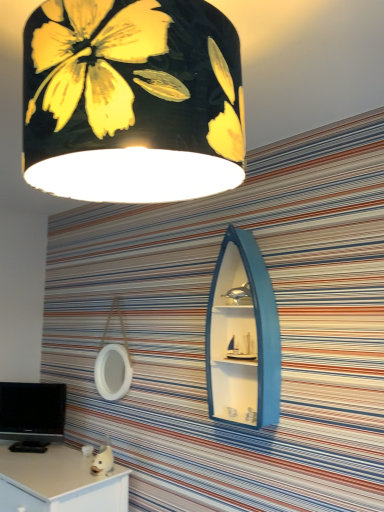
The height and width of the screenshot is (512, 384). What do you see at coordinates (32, 414) in the screenshot?
I see `black glossy computer monitor at lower left` at bounding box center [32, 414].

Locate an element on the screen. This screenshot has width=384, height=512. black glossy computer monitor at lower left is located at coordinates (32, 414).

I want to click on white matte desk at lower left, so click(59, 482).

What do you see at coordinates (132, 100) in the screenshot?
I see `black matte lampshade at upper center` at bounding box center [132, 100].

Describe the element at coordinates (242, 336) in the screenshot. This screenshot has width=384, height=512. I see `blue matte boat-shaped cabinet at center` at that location.

Identify the location of black glossy computer monitor at lower left. (32, 414).

Looking at this image, is black matte lampshade at upper center in front of or behind blue matte boat-shaped cabinet at center in the image?

black matte lampshade at upper center is positioned closer to the viewer than blue matte boat-shaped cabinet at center.

How many degrees apart are the facing directions of black matte lampshade at upper center and blue matte boat-shaped cabinet at center?

black matte lampshade at upper center and blue matte boat-shaped cabinet at center are facing 89.6 degrees away from each other.

From the image's perspective, between black matte lampshade at upper center and blue matte boat-shaped cabinet at center, which one is located above?

black matte lampshade at upper center, from the image's perspective.

Considering the relative sizes of black matte lampshade at upper center and blue matte boat-shaped cabinet at center in the image provided, is black matte lampshade at upper center smaller than blue matte boat-shaped cabinet at center?

No.

Looking at their sizes, would you say white matte desk at lower left is wider or thinner than blue matte boat-shaped cabinet at center?

Clearly, white matte desk at lower left has more width compared to blue matte boat-shaped cabinet at center.

In the scene shown: Is white matte desk at lower left located outside blue matte boat-shaped cabinet at center?

Indeed, white matte desk at lower left is completely outside blue matte boat-shaped cabinet at center.

Is point (67, 494) positioned after point (269, 367)?

Yes, point (67, 494) is behind point (269, 367).

Which of these two, white matte desk at lower left or blue matte boat-shaped cabinet at center, stands shorter?

With less height is white matte desk at lower left.

Choose the correct answer: Is black glossy computer monitor at lower left inside blue matte boat-shaped cabinet at center or outside it?

The correct answer is: outside.

Identify the location of computer monitor that is under the blue matte boat-shaped cabinet at center (from a real-world perspective). This screenshot has width=384, height=512. (32, 414).

Between point (21, 410) and point (230, 227), which one is positioned in front?

The point (230, 227) is more forward.

Is the surface of black glossy computer monitor at lower left in direct contact with blue matte boat-shaped cabinet at center?

black glossy computer monitor at lower left is not next to blue matte boat-shaped cabinet at center, and they're not touching.

Would you say blue matte boat-shaped cabinet at center is inside or outside white matte desk at lower left?

blue matte boat-shaped cabinet at center is outside white matte desk at lower left.

Which is behind, blue matte boat-shaped cabinet at center or white matte desk at lower left?

Positioned behind is white matte desk at lower left.

Who is shorter, blue matte boat-shaped cabinet at center or white matte desk at lower left?

With less height is white matte desk at lower left.

Could you tell me if white matte desk at lower left is turned towards black glossy computer monitor at lower left?

No, white matte desk at lower left is not turned towards black glossy computer monitor at lower left.

Considering the sizes of objects white matte desk at lower left and black glossy computer monitor at lower left in the image provided, who is bigger, white matte desk at lower left or black glossy computer monitor at lower left?

With larger size is white matte desk at lower left.

Can you tell me how much white matte desk at lower left and black glossy computer monitor at lower left differ in facing direction?

The angle between the facing direction of white matte desk at lower left and the facing direction of black glossy computer monitor at lower left is 35.6 degrees.

Is white matte desk at lower left to the left of black glossy computer monitor at lower left from the viewer's perspective?

Incorrect, white matte desk at lower left is not on the left side of black glossy computer monitor at lower left.

Is black glossy computer monitor at lower left at the right side of white matte desk at lower left?

No, black glossy computer monitor at lower left is not to the right of white matte desk at lower left.

This screenshot has width=384, height=512. Find the location of `desk that appears on the right of black glossy computer monitor at lower left`. desk that appears on the right of black glossy computer monitor at lower left is located at coordinates (59, 482).

Is there a large distance between black glossy computer monitor at lower left and white matte desk at lower left?

They are positioned close to each other.

Would you say black glossy computer monitor at lower left is inside or outside white matte desk at lower left?

The correct answer is: outside.

Which of these two, white matte desk at lower left or black matte lampshade at upper center, is wider?

With larger width is white matte desk at lower left.

From the image's perspective, between white matte desk at lower left and black matte lampshade at upper center, which one is located above?

black matte lampshade at upper center is shown above in the image.

Is black matte lampshade at upper center completely or partially inside white matte desk at lower left?

Definitely not — black matte lampshade at upper center is not inside white matte desk at lower left.

How much distance is there between white matte desk at lower left and black matte lampshade at upper center?

5.18 feet.

Identify the location of medicine cabinet located on the right of black matte lampshade at upper center. (242, 336).

Find the location of a particular element. This screenshot has width=384, height=512. desk to the left of blue matte boat-shaped cabinet at center is located at coordinates (59, 482).

When comparing their distances from black glossy computer monitor at lower left, does black matte lampshade at upper center or blue matte boat-shaped cabinet at center seem closer?

blue matte boat-shaped cabinet at center lies closer to black glossy computer monitor at lower left than the other object.

Looking at the image, which one is located closer to black matte lampshade at upper center, white matte desk at lower left or black glossy computer monitor at lower left?

The object closer to black matte lampshade at upper center is white matte desk at lower left.

Which object lies nearer to the anchor point white matte desk at lower left, blue matte boat-shaped cabinet at center or black matte lampshade at upper center?

The object closer to white matte desk at lower left is blue matte boat-shaped cabinet at center.

Based on the photo, from the image, which object appears to be nearer to black matte lampshade at upper center, white matte desk at lower left or blue matte boat-shaped cabinet at center?

blue matte boat-shaped cabinet at center.

Which object lies further to the anchor point blue matte boat-shaped cabinet at center, black glossy computer monitor at lower left or black matte lampshade at upper center?

black glossy computer monitor at lower left lies further to blue matte boat-shaped cabinet at center than the other object.

Considering their positions, is black glossy computer monitor at lower left positioned closer to white matte desk at lower left than black matte lampshade at upper center?

black glossy computer monitor at lower left is closer to white matte desk at lower left.

Which object lies further to the anchor point black matte lampshade at upper center, blue matte boat-shaped cabinet at center or black glossy computer monitor at lower left?

Among the two, black glossy computer monitor at lower left is located further to black matte lampshade at upper center.

When comparing their distances from blue matte boat-shaped cabinet at center, does white matte desk at lower left or black matte lampshade at upper center seem further?

Among the two, white matte desk at lower left is located further to blue matte boat-shaped cabinet at center.

The width and height of the screenshot is (384, 512). I want to click on medicine cabinet between black matte lampshade at upper center and white matte desk at lower left in the vertical direction, so click(x=242, y=336).

Locate an element on the screen. The width and height of the screenshot is (384, 512). desk located between black glossy computer monitor at lower left and blue matte boat-shaped cabinet at center in the left-right direction is located at coordinates (59, 482).

You are a GUI agent. You are given a task and a screenshot of the screen. Output one action in this format:
    pyautogui.click(x=<x>, y=<y>)
    Task: Click on the medicine cabinet between black matte lampshade at upper center and black glossy computer monitor at lower left from front to back
    
    Given the screenshot: What is the action you would take?
    pyautogui.click(x=242, y=336)

You are a GUI agent. You are given a task and a screenshot of the screen. Output one action in this format:
    pyautogui.click(x=<x>, y=<y>)
    Task: Click on the desk located between black matte lampshade at upper center and black glossy computer monitor at lower left in the depth direction
    The height and width of the screenshot is (512, 384).
    Given the screenshot: What is the action you would take?
    point(59,482)